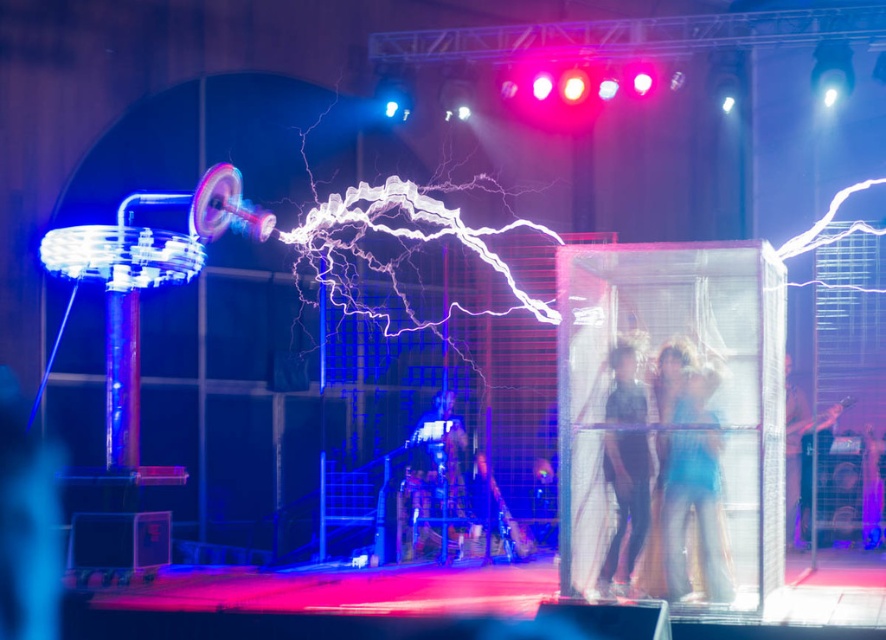
Question: Is blue denim jeans at center positioned at the back of light blue fabric at right?

Choices:
 (A) yes
 (B) no

Answer: (B)

Question: Which object is closer to the camera taking this photo?

Choices:
 (A) dark blue fabric at center
 (B) light blue fabric at right

Answer: (A)

Question: Which object is positioned closest to the blue denim jeans at center?

Choices:
 (A) light blue fabric at right
 (B) dark blue fabric at center

Answer: (B)

Question: Estimate the real-world distances between objects in this image. Which object is closer to the light blue fabric at right?

Choices:
 (A) blue denim jeans at center
 (B) dark blue fabric at center

Answer: (A)

Question: Is blue denim jeans at center closer to camera compared to dark blue fabric at center?

Choices:
 (A) yes
 (B) no

Answer: (A)

Question: Is blue denim jeans at center smaller than dark blue fabric at center?

Choices:
 (A) no
 (B) yes

Answer: (A)